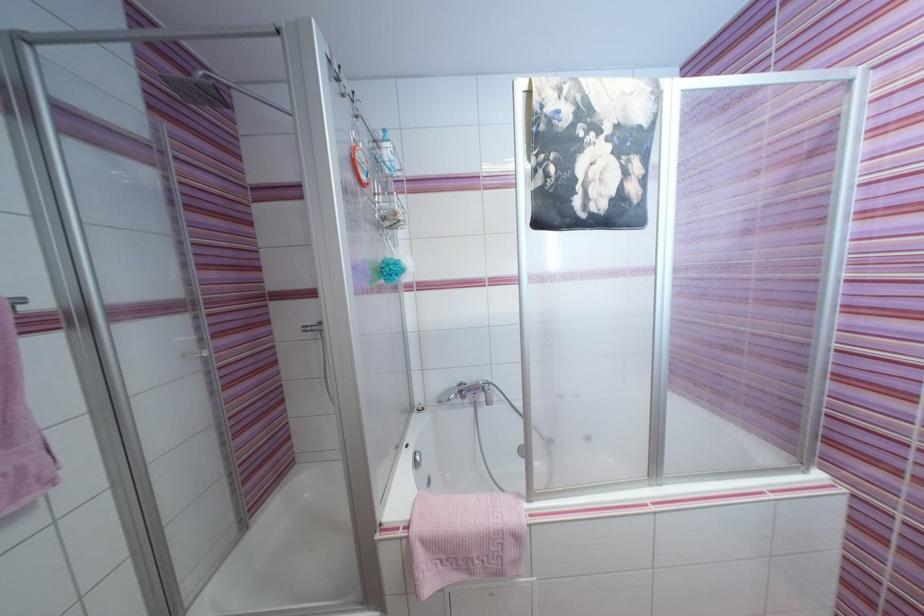
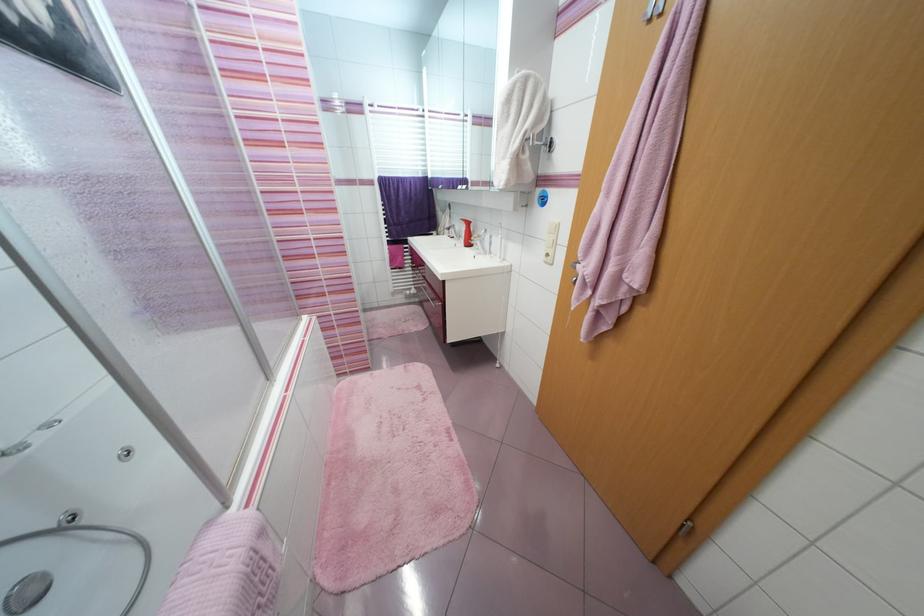
How did the camera likely rotate?

The camera rotated toward right-down.